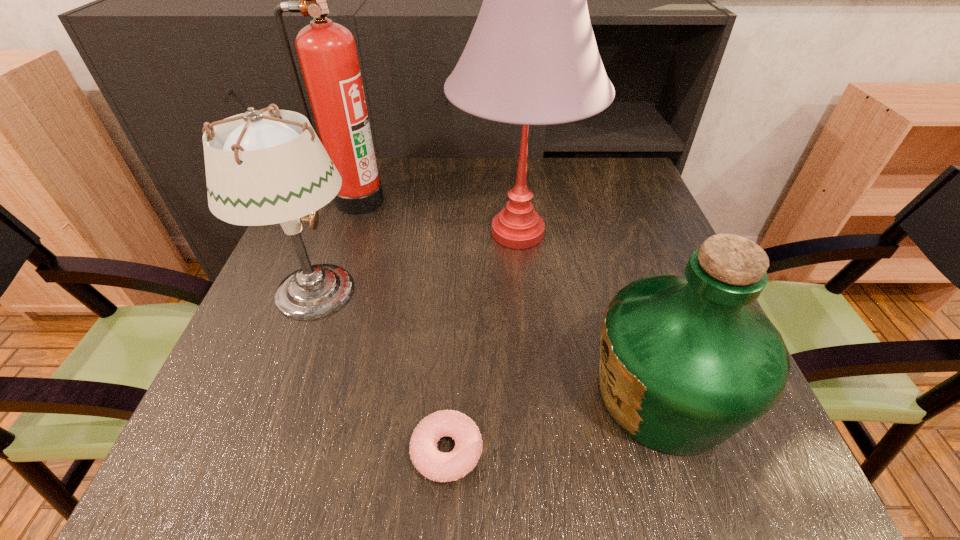
Locate an element on the screen. Image resolution: width=960 pixels, height=540 pixels. table lamp is located at coordinates (532, 59).

Locate an element on the screen. fire extinguisher is located at coordinates (327, 53).

Where is `the third tallest object`? This screenshot has width=960, height=540. the third tallest object is located at coordinates (260, 170).

Where is `the fourth tallest object`? The width and height of the screenshot is (960, 540). the fourth tallest object is located at coordinates (686, 362).

Locate an element on the screen. the shortest object is located at coordinates (441, 467).

Identify the location of free location located 0.200m on the front-facing side of the table lamp. This screenshot has height=540, width=960. (368, 233).

Identify the location of free space located 0.250m on the front-facing side of the table lamp. tap(347, 233).

You are a GUI agent. You are given a task and a screenshot of the screen. Output one action in this format:
    pyautogui.click(x=<x>, y=<y>)
    Task: Click on the vacant space located on the front-facing side of the table lamp
    
    Given the screenshot: What is the action you would take?
    pyautogui.click(x=313, y=233)

I want to click on free space located with the nozzle pointing from the back of the fire extinguisher, so click(x=337, y=261).

Image resolution: width=960 pixels, height=540 pixels. I want to click on vacant space located on the lampshade of the third tallest object, so click(x=508, y=293).